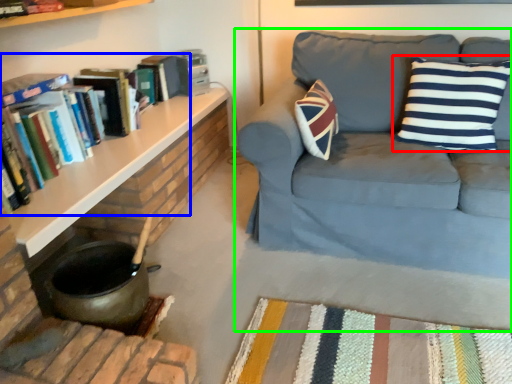
Question: Based on their relative distances, which object is nearer to pillow (highlighted by a red box)? Choose from book (highlighted by a blue box) and studio couch (highlighted by a green box).

Choices:
 (A) book
 (B) studio couch

Answer: (B)